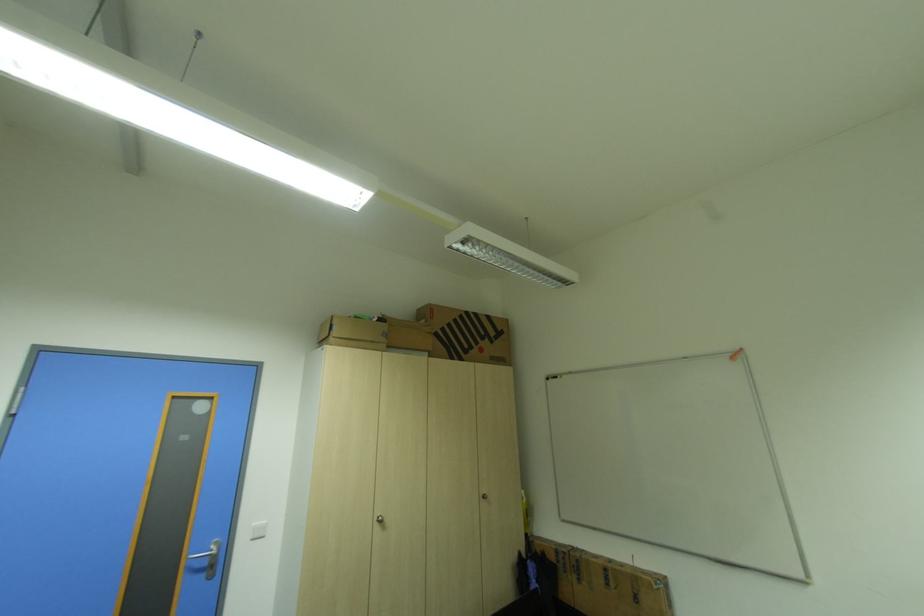
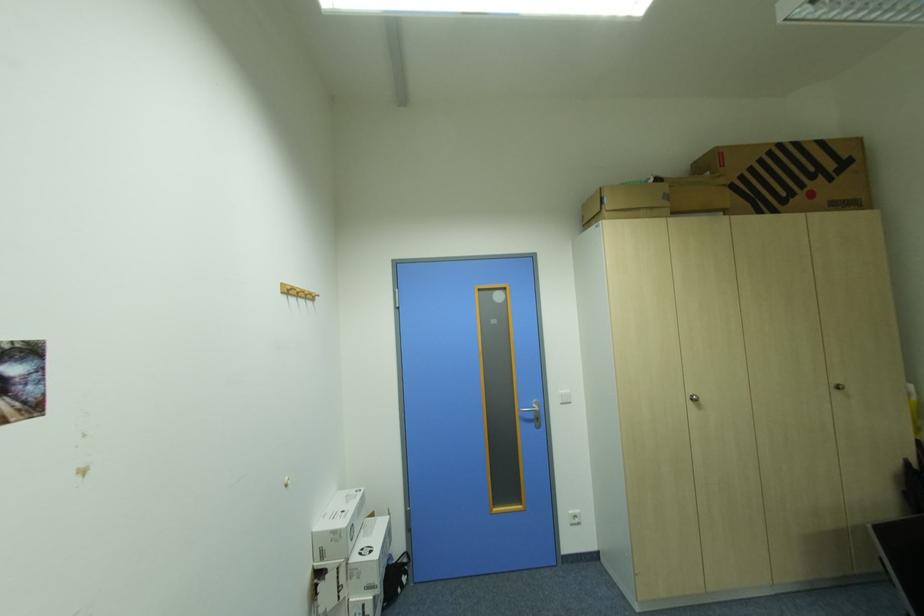
Find the pixel in the second image that matches pixel 468 317 in the first image.

(777, 153)